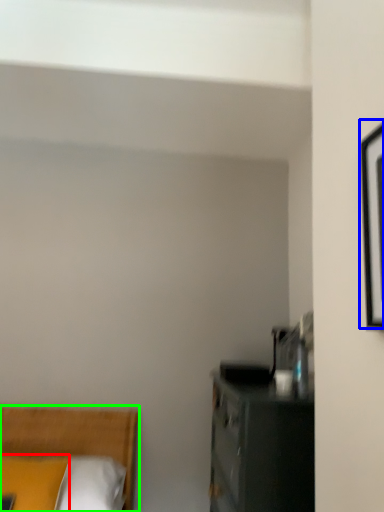
Question: Which object is positioned farthest from pillow (highlighted by a red box)? Select from picture frame (highlighted by a blue box) and bed (highlighted by a green box).

Choices:
 (A) picture frame
 (B) bed

Answer: (A)